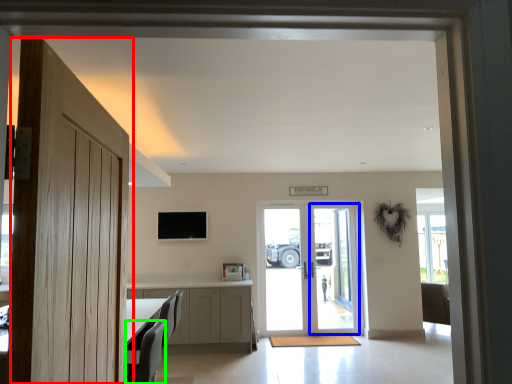
Question: Based on their relative distances, which object is farther from door (highlighted by a red box)? Choose from screen door (highlighted by a blue box) and armchair (highlighted by a green box).

Choices:
 (A) screen door
 (B) armchair

Answer: (A)